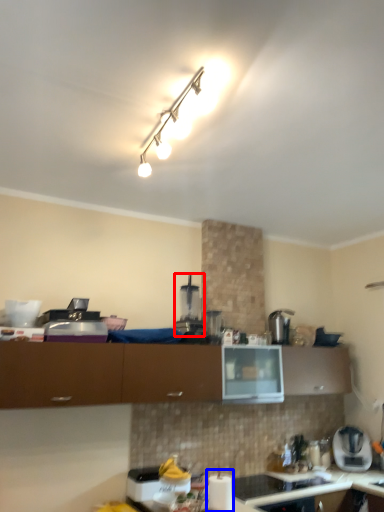
Question: Which point is closer to the camera, coffee machine (highlighted by a red box) or appliance (highlighted by a blue box)?

Choices:
 (A) coffee machine
 (B) appliance

Answer: (B)